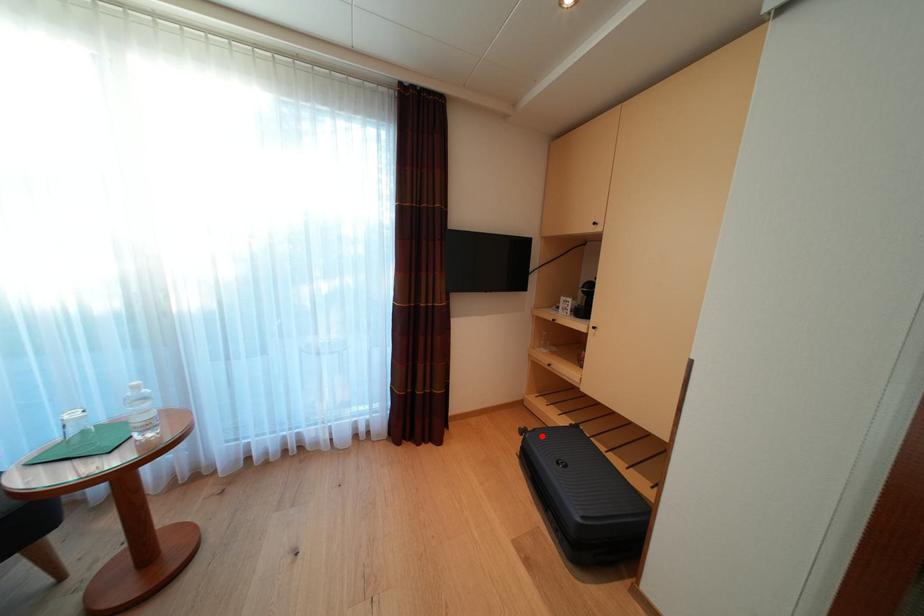
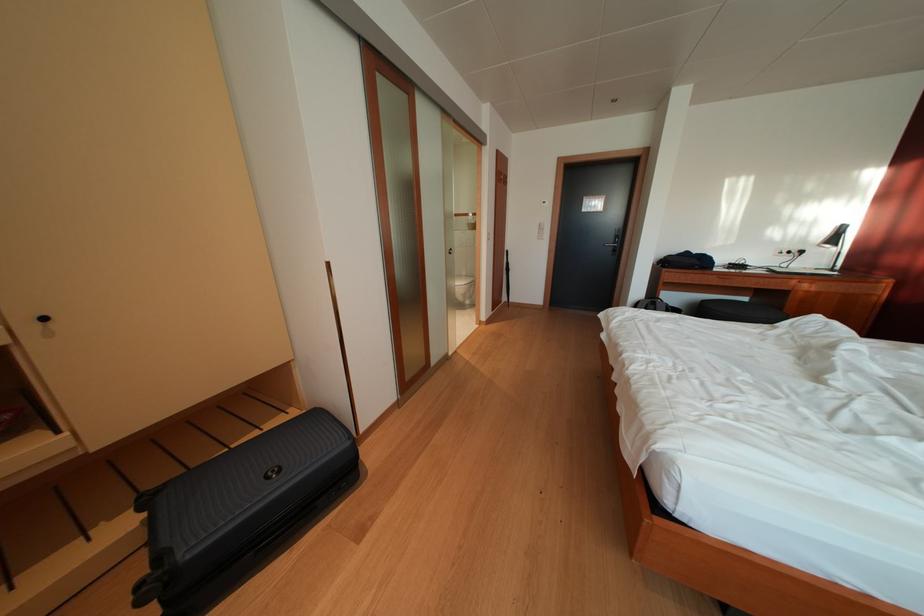
The point at the highlighted location is marked in the first image. Where is the corresponding point in the second image?

(167, 562)